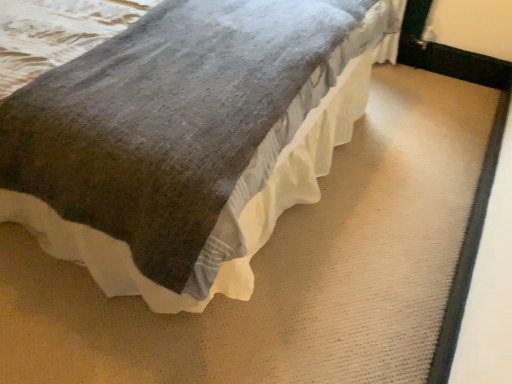
The height and width of the screenshot is (384, 512). What do you see at coordinates (187, 140) in the screenshot? I see `textured gray blanket at center` at bounding box center [187, 140].

Where is `textured gray blanket at center`? textured gray blanket at center is located at coordinates (187, 140).

You are a GUI agent. You are given a task and a screenshot of the screen. Output one action in this format:
    pyautogui.click(x=<x>, y=<y>)
    Task: Click on the textured gray blanket at center
    This screenshot has height=384, width=512.
    Given the screenshot: What is the action you would take?
    pyautogui.click(x=187, y=140)